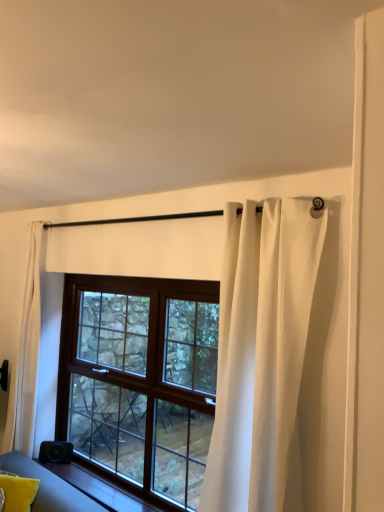
Question: Considering the positions of point (309, 276) and point (29, 378), is point (309, 276) closer or farther from the camera than point (29, 378)?

Choices:
 (A) farther
 (B) closer

Answer: (B)

Question: From the image's perspective, is white sheer curtain at upper center, placed as the 2th curtain when sorted from left to right, located above or below white sheer curtain at left, the second curtain viewed from the right?

Choices:
 (A) above
 (B) below

Answer: (A)

Question: Which is nearer to the brown wooden window at center?

Choices:
 (A) smooth wood window sill at lower left
 (B) white sheer curtain at left, placed as the 1th curtain when sorted from left to right
 (C) yellow fabric pillow at lower left
 (D) white sheer curtain at upper center, which is counted as the 2th curtain, starting from the back

Answer: (A)

Question: Which object is positioned closest to the brown wooden window at center?

Choices:
 (A) yellow fabric pillow at lower left
 (B) white sheer curtain at left, positioned as the 2th curtain in front-to-back order
 (C) smooth wood window sill at lower left
 (D) white sheer curtain at upper center, the 1th curtain positioned from the front

Answer: (C)